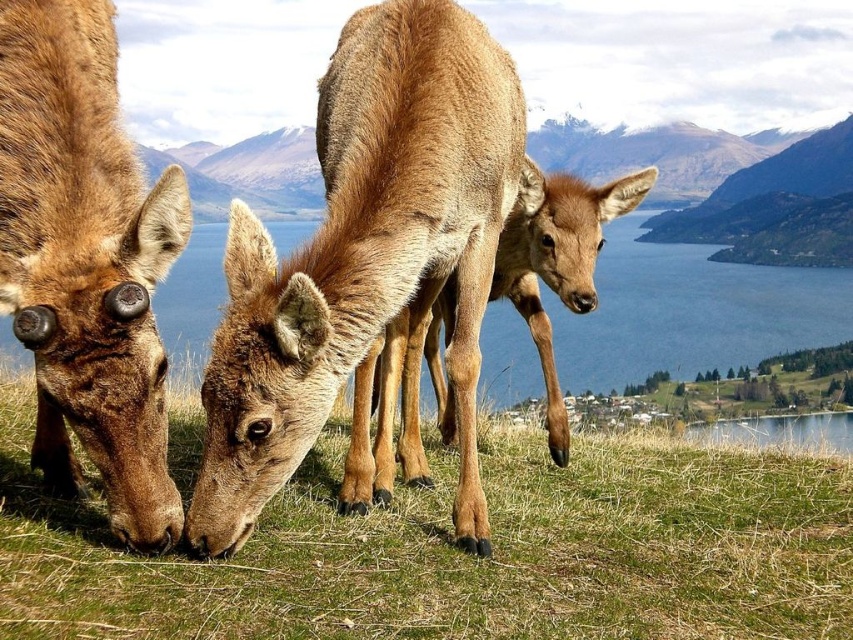
Between green grass at center and brown matte fur at lower left, which one has more height?

With more height is brown matte fur at lower left.

Who is lower down, green grass at center or brown matte fur at lower left?

green grass at center

The width and height of the screenshot is (853, 640). What do you see at coordinates (461, 552) in the screenshot? I see `green grass at center` at bounding box center [461, 552].

Where is `green grass at center`? green grass at center is located at coordinates (461, 552).

Does brown fur deer at center come behind brown matte fur at lower left?

Yes, it is.

Is point (227, 464) positioned behind point (35, 449)?

No, (227, 464) is closer to viewer.

Describe the element at coordinates (367, 268) in the screenshot. I see `brown fur deer at center` at that location.

Locate an element on the screen. Image resolution: width=853 pixels, height=640 pixels. brown fur deer at center is located at coordinates coord(367,268).

Does green grass at center appear under clear blue water at center?

Yes, green grass at center is below clear blue water at center.

Is green grass at center positioned in front of clear blue water at center?

Yes, green grass at center is closer to the viewer.

The height and width of the screenshot is (640, 853). Describe the element at coordinates (461, 552) in the screenshot. I see `green grass at center` at that location.

Locate an element on the screen. The width and height of the screenshot is (853, 640). green grass at center is located at coordinates (461, 552).